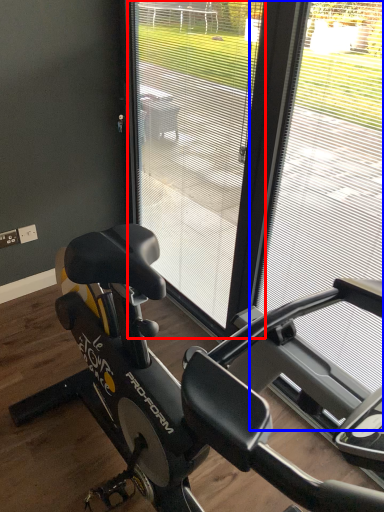
Question: Which object appears closest to the camera in this image, screen door (highlighted by a red box) or window frame (highlighted by a blue box)?

Choices:
 (A) screen door
 (B) window frame

Answer: (B)